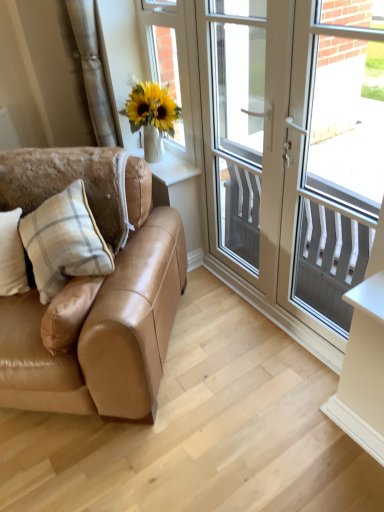
Question: Looking at their shapes, would you say white glossy screen door at upper right is wider or thinner than white textured screen at right, arranged as the 2th window screen when viewed from the left?

Choices:
 (A) wide
 (B) thin

Answer: (A)

Question: Based on their sizes in the image, would you say white glossy screen door at upper right is bigger or smaller than white textured screen at right, the first window screen when ordered from right to left?

Choices:
 (A) big
 (B) small

Answer: (A)

Question: Which of these objects is positioned closest to the white plastic door at center?

Choices:
 (A) white textured screen at right, the first window screen when ordered from right to left
 (B) satin tan leather couch at left
 (C) white plaid pillow at left, the second pillow when ordered from right to left
 (D) beige plaid pillow at left, the second pillow from the left
 (E) white glossy screen door at upper right

Answer: (E)

Question: Which of these objects is positioned closest to the white plaid pillow at left, placed as the 1th pillow when sorted from left to right?

Choices:
 (A) beige fabric curtain at upper left
 (B) white textured screen at right, arranged as the 2th window screen when viewed from the left
 (C) matte glass vase at upper left, arranged as the 1th window screen when viewed from the left
 (D) satin tan leather couch at left
 (E) white glossy screen door at upper right

Answer: (D)